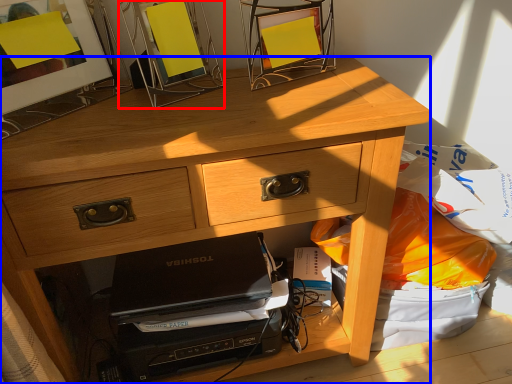
Question: Which object appears farthest to the camera in this image, picture frame (highlighted by a red box) or desk (highlighted by a blue box)?

Choices:
 (A) picture frame
 (B) desk

Answer: (A)